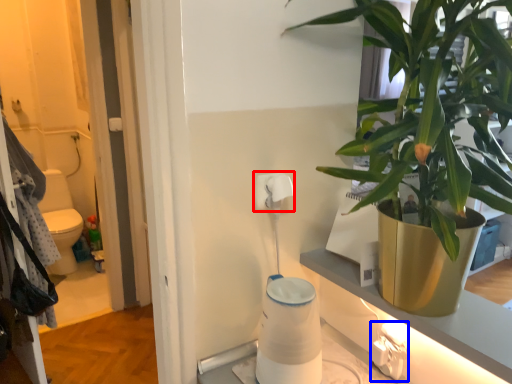
Question: Among these objects, which one is farthest to the camera, toilet paper (highlighted by a red box) or electric outlet (highlighted by a blue box)?

Choices:
 (A) toilet paper
 (B) electric outlet

Answer: (A)